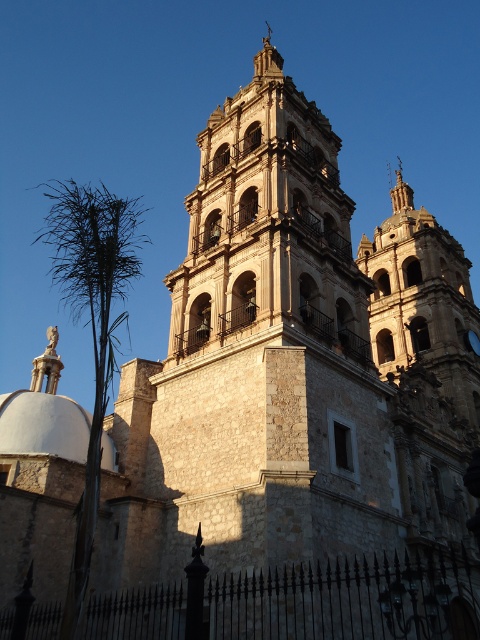
Is stone bell tower at upper right taller than green leafy palm tree at left?

No.

Does stone bell tower at upper right lie behind green leafy palm tree at left?

Yes, stone bell tower at upper right is behind green leafy palm tree at left.

What do you see at coordinates (422, 301) in the screenshot? I see `stone bell tower at upper right` at bounding box center [422, 301].

Find the location of a particular element. stone bell tower at upper right is located at coordinates (422, 301).

Does green leafy palm tree at left have a larger size compared to white stone dome at lower left?

Correct, green leafy palm tree at left is larger in size than white stone dome at lower left.

The image size is (480, 640). What do you see at coordinates (91, 324) in the screenshot?
I see `green leafy palm tree at left` at bounding box center [91, 324].

Locate an element on the screen. green leafy palm tree at left is located at coordinates (91, 324).

Can you confirm if stone bell tower at upper right is wider than white stone dome at lower left?

Yes, stone bell tower at upper right is wider than white stone dome at lower left.

Is stone bell tower at upper right to the right of white stone dome at lower left from the viewer's perspective?

Yes, stone bell tower at upper right is to the right of white stone dome at lower left.

In order to click on stone bell tower at upper right in this screenshot , I will do `click(422, 301)`.

This screenshot has height=640, width=480. What are the coordinates of `stone bell tower at upper right` in the screenshot? It's located at (422, 301).